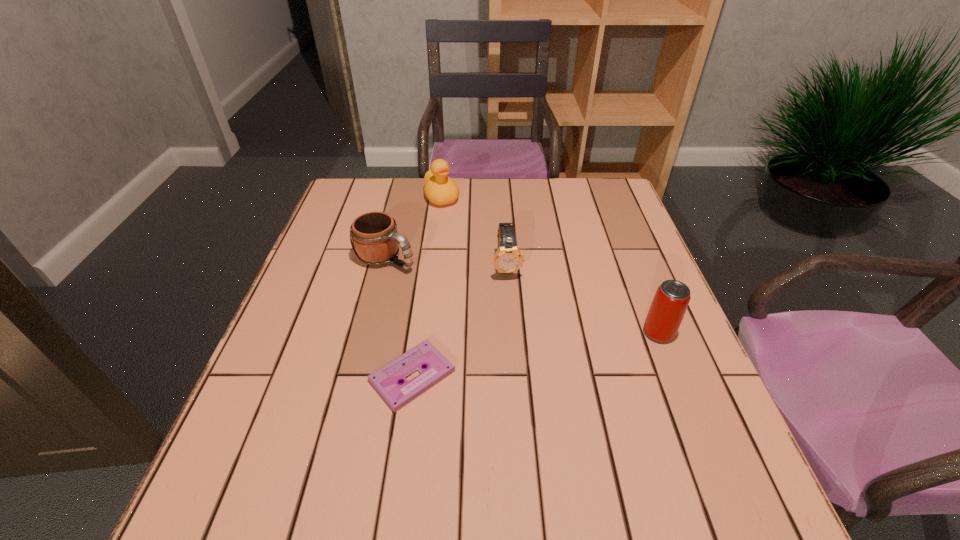
Identify the location of free area in between the rightmost object and the videotape. Image resolution: width=960 pixels, height=540 pixels. (536, 354).

Image resolution: width=960 pixels, height=540 pixels. Identify the location of empty space that is in between the rightmost object and the mug. (522, 295).

At what (x,y) coordinates should I click in order to perform the action: click on vacant area between the mug and the second object from right to left. Please return your answer as a coordinate pair (x, y). The image size is (960, 540). Looking at the image, I should click on (446, 262).

Where is `object that stands as the second closest to the mug`? This screenshot has width=960, height=540. object that stands as the second closest to the mug is located at coordinates (508, 258).

Locate which object is the third closest to the shortest object. Please provide its 2D coordinates. Your answer should be formatted as a tuple, i.e. [(x, y)], where the tuple contains the x and y coordinates of a point satisfying the conditions above.

[(672, 297)]

The height and width of the screenshot is (540, 960). I want to click on vacant space that satisfies the following two spatial constraints: 1. on the front side of the duck; 2. on the left side of the rightmost object, so click(x=425, y=333).

The width and height of the screenshot is (960, 540). What are the coordinates of `free space that satisfies the following two spatial constraints: 1. on the back side of the shortest object; 2. on the right side of the farthest object` in the screenshot? It's located at (437, 197).